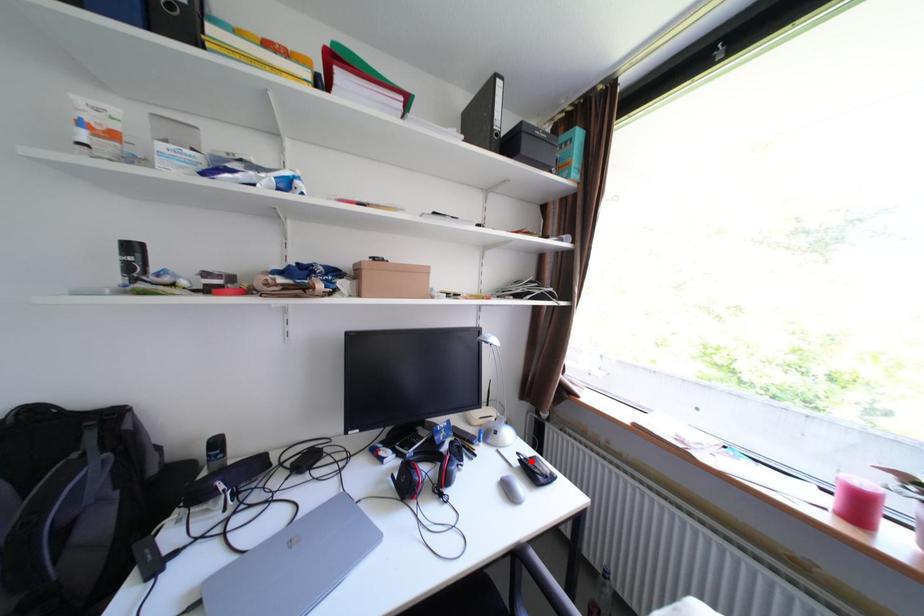
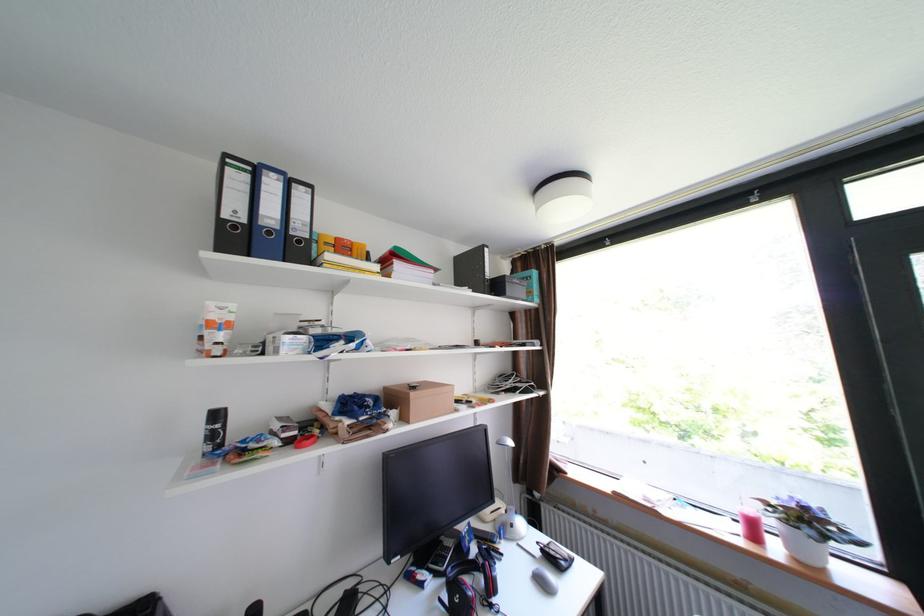
In the second image, find the point that corresponds to the highlighted location in the first image.

(553, 551)